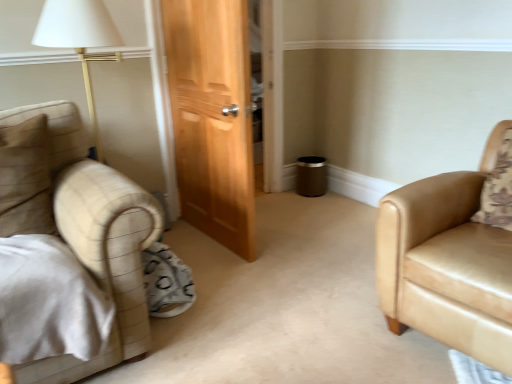
You are a GUI agent. You are given a task and a screenshot of the screen. Output one action in this format:
    pyautogui.click(x=<x>, y=<y>)
    Task: Click on the free location to the left of tan leather armchair at right
    The image size is (512, 384).
    Given the screenshot: What is the action you would take?
    [308, 306]